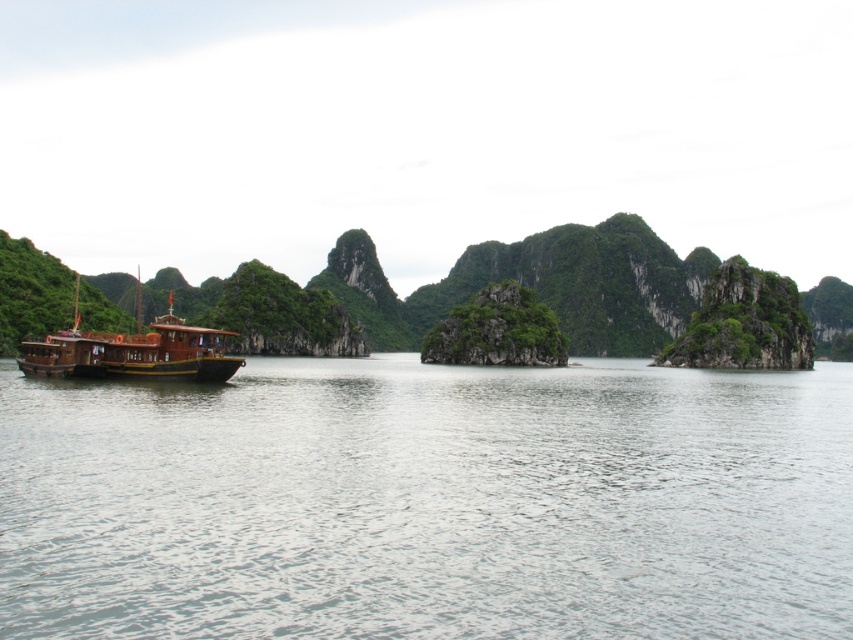
You are standing on the wooden boat at left and want to jump into the clear water at left. Will your jump land you into the water?

Yes, because the clear water at left has a lesser height compared to the wooden boat at left, so the boat is higher up and jumping from it would land you into the water.

You are standing on the boat and looking at two points in the water. The first point is at coordinates point (558, 392) and the second point is at point (227, 356). Which point is closer to you?

Point (558, 392) is further to the camera than point (227, 356), so the second point is closer to you.